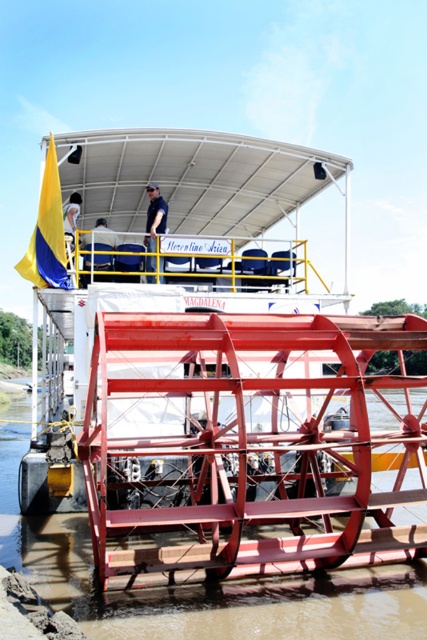
Question: Can you confirm if brown metallic river at lower center is positioned to the right of dark blue shirt at upper center?

Choices:
 (A) yes
 (B) no

Answer: (A)

Question: Which of the following is the farthest from the observer?

Choices:
 (A) [x=149, y=257]
 (B) [x=72, y=211]
 (C) [x=94, y=280]
 (D) [x=236, y=545]

Answer: (B)

Question: Does metallic red paddlewheel at center appear on the left side of dark blue uniform at upper center?

Choices:
 (A) yes
 (B) no

Answer: (B)

Question: Which object appears closest to the camera in this image?

Choices:
 (A) blue fabric shirt at upper center
 (B) brown metallic river at lower center

Answer: (B)

Question: Among these points, which one is nearest to the camera?

Choices:
 (A) (72, 196)
 (B) (350, 582)
 (C) (303, 330)
 (D) (96, 241)

Answer: (B)

Question: In this image, where is blue fabric shirt at upper center located relative to dark blue uniform at upper center?

Choices:
 (A) left
 (B) right

Answer: (B)